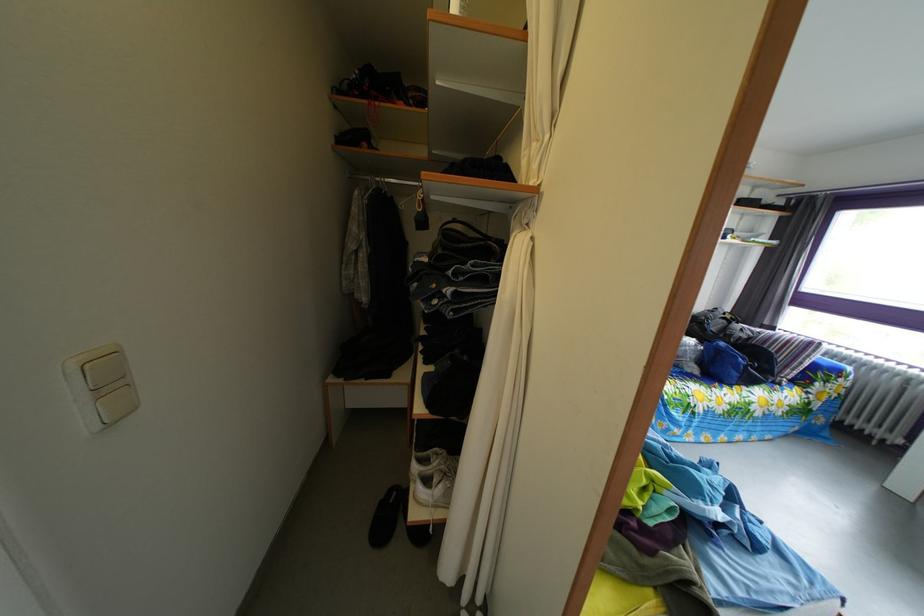
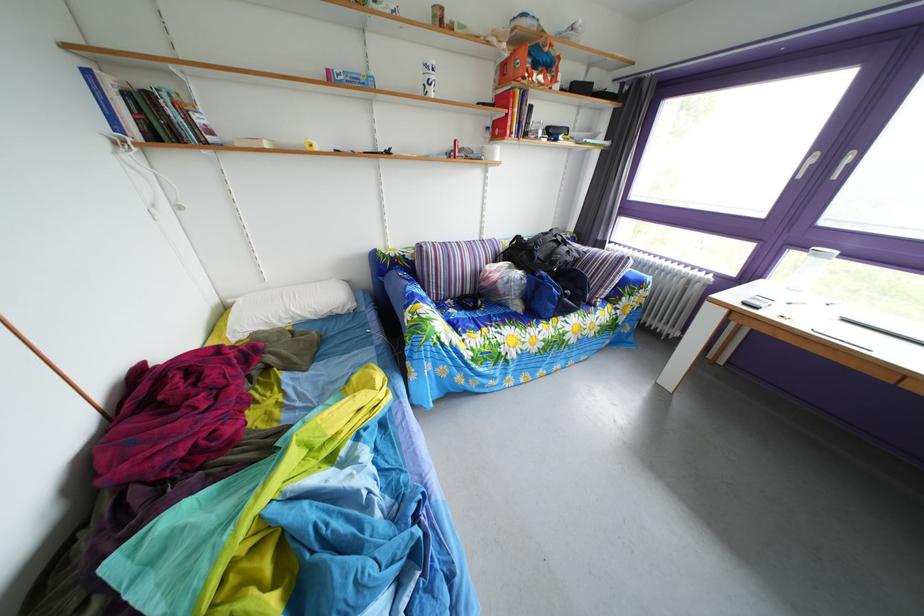
In the second image, find the point that corresponds to point 734,352 in the first image.

(553, 282)